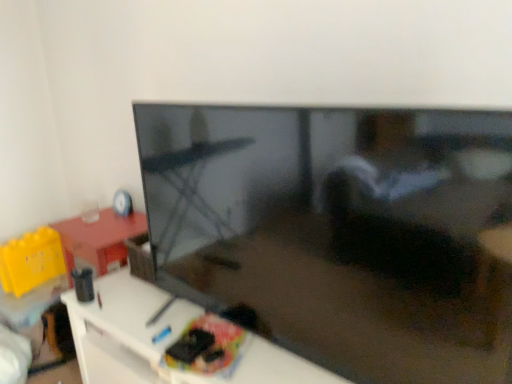
Describe the element at coordinates (340, 231) in the screenshot. This screenshot has width=512, height=384. I see `matte black tv at center` at that location.

The height and width of the screenshot is (384, 512). I want to click on matte black tv at center, so click(x=340, y=231).

Which object is further away from the camera taking this photo, white glossy tv stand at lower left or matte black tv at center?

white glossy tv stand at lower left.

Does point (126, 283) lie behind point (205, 111)?

That is True.

Does white glossy tv stand at lower left have a larger size compared to matte black tv at center?

Yes, white glossy tv stand at lower left is bigger than matte black tv at center.

Which of these two, white glossy tv stand at lower left or matte black tv at center, is wider?

Wider between the two is white glossy tv stand at lower left.

Is matte plastic cd at upper left wider than white glossy tv stand at lower left?

No, matte plastic cd at upper left is not wider than white glossy tv stand at lower left.

Between matte plastic cd at upper left and white glossy tv stand at lower left, which one appears on the left side from the viewer's perspective?

matte plastic cd at upper left.

Considering the sizes of objects matte plastic cd at upper left and white glossy tv stand at lower left in the image provided, who is taller, matte plastic cd at upper left or white glossy tv stand at lower left?

With more height is white glossy tv stand at lower left.

Between matte plastic cd at upper left and white glossy tv stand at lower left, which one has smaller size?

With smaller size is matte plastic cd at upper left.

From a real-world perspective, relative to matte plastic cd at upper left, is matte black tv at center vertically above or below?

matte black tv at center is situated higher than matte plastic cd at upper left in the real world.

Is matte black tv at center looking in the opposite direction of matte plastic cd at upper left?

No, matte black tv at center's orientation is not away from matte plastic cd at upper left.

From the image's perspective, relative to matte plastic cd at upper left, is matte black tv at center above or below?

Clearly, from the image's perspective, matte black tv at center is below matte plastic cd at upper left.

Between matte black tv at center and matte plastic cd at upper left, which one has larger width?

Wider between the two is matte black tv at center.

Considering the sizes of objects matte plastic cd at upper left and matte black tv at center in the image provided, who is smaller, matte plastic cd at upper left or matte black tv at center?

With smaller size is matte plastic cd at upper left.

Is matte plastic cd at upper left placed right next to matte black tv at center?

matte plastic cd at upper left and matte black tv at center are clearly separated.

How many degrees apart are the facing directions of matte plastic cd at upper left and matte black tv at center?

The facing directions of matte plastic cd at upper left and matte black tv at center are 4.37 degrees apart.

Which object is positioned more to the left, matte plastic cd at upper left or matte black tv at center?

Positioned to the left is matte plastic cd at upper left.

Between white glossy tv stand at lower left and matte plastic cd at upper left, which one has larger width?

white glossy tv stand at lower left.

This screenshot has height=384, width=512. Identify the location of furniture on the right of matte plastic cd at upper left. (162, 341).

Is white glossy tv stand at lower left turned away from matte plastic cd at upper left?

white glossy tv stand at lower left does not have its back to matte plastic cd at upper left.

Does matte black tv at center have a lesser height compared to white glossy tv stand at lower left?

No, matte black tv at center is not shorter than white glossy tv stand at lower left.

Between point (482, 369) and point (103, 287), which one is positioned in front?

The point (482, 369) is closer.

Which object is thinner, matte black tv at center or white glossy tv stand at lower left?

matte black tv at center is thinner.

Is matte black tv at center at the left side of white glossy tv stand at lower left?

In fact, matte black tv at center is to the right of white glossy tv stand at lower left.

The image size is (512, 384). I want to click on television that appears above the white glossy tv stand at lower left (from a real-world perspective), so click(x=340, y=231).

You are a GUI agent. You are given a task and a screenshot of the screen. Output one action in this format:
    pyautogui.click(x=<x>, y=<y>)
    Task: Click on the furniture that is on the right side of matte plastic cd at upper left
    This screenshot has height=384, width=512.
    Given the screenshot: What is the action you would take?
    pyautogui.click(x=162, y=341)

From the image, which object appears to be farther from matte black tv at center, matte plastic cd at upper left or white glossy tv stand at lower left?

The object further to matte black tv at center is matte plastic cd at upper left.

Looking at the image, which one is located closer to white glossy tv stand at lower left, matte plastic cd at upper left or matte black tv at center?

matte black tv at center is positioned closer to the anchor white glossy tv stand at lower left.

Which object lies further to the anchor point white glossy tv stand at lower left, matte black tv at center or matte plastic cd at upper left?

Based on the image, matte plastic cd at upper left appears to be further to white glossy tv stand at lower left.

Based on their spatial positions, is white glossy tv stand at lower left or matte black tv at center closer to matte plastic cd at upper left?

white glossy tv stand at lower left is closer to matte plastic cd at upper left.

Estimate the real-world distances between objects in this image. Which object is closer to matte black tv at center, white glossy tv stand at lower left or matte plastic cd at upper left?

Among the two, white glossy tv stand at lower left is located nearer to matte black tv at center.

Which object lies nearer to the anchor point matte plastic cd at upper left, matte black tv at center or white glossy tv stand at lower left?

Based on the image, white glossy tv stand at lower left appears to be nearer to matte plastic cd at upper left.

Where is `furniture between matte black tv at center and matte plastic cd at upper left along the z-axis`? Image resolution: width=512 pixels, height=384 pixels. furniture between matte black tv at center and matte plastic cd at upper left along the z-axis is located at coordinates (162, 341).